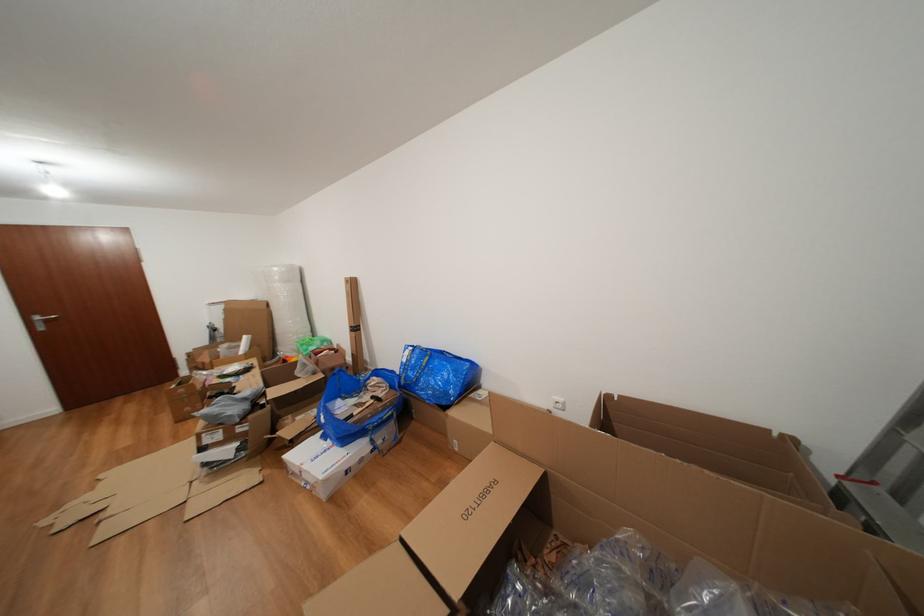
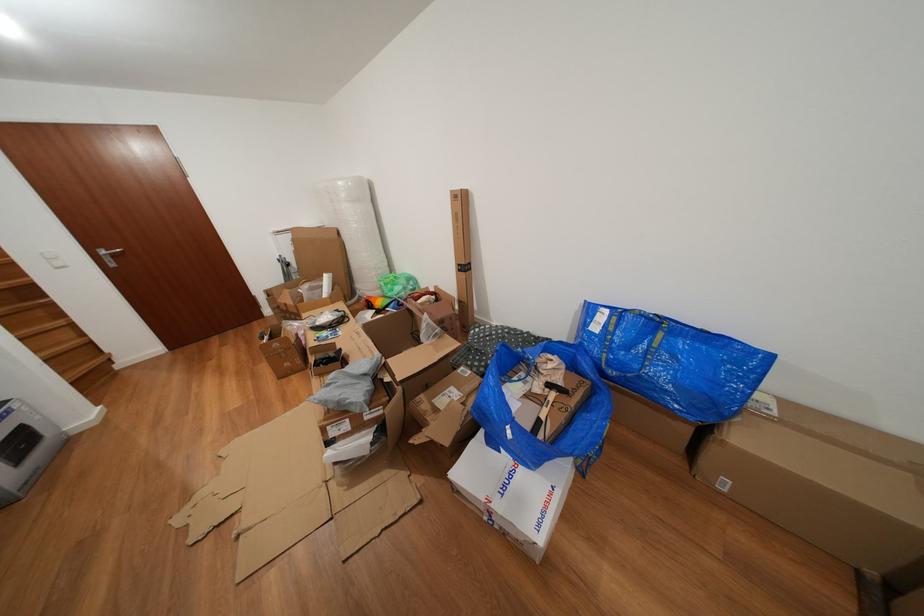
In a continuous first-person perspective shot, in which direction is the camera moving?

The movement direction of the cameraman is left, forward.